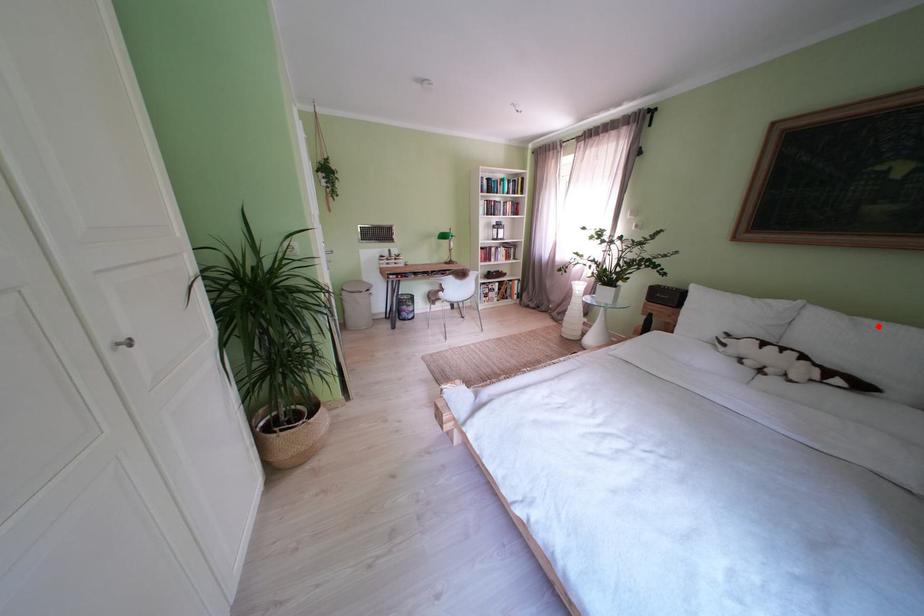
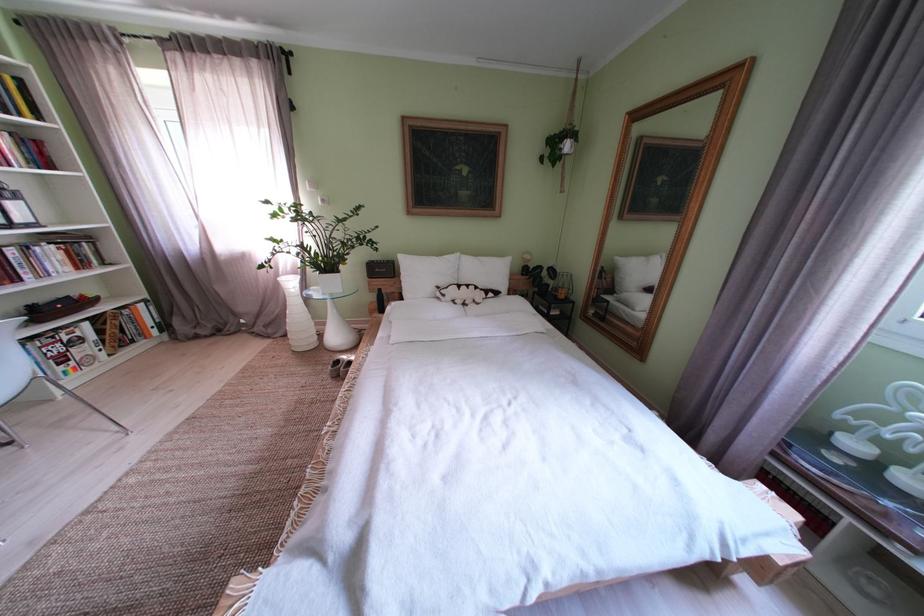
In the second image, find the point that corresponds to the highlighted location in the first image.

(492, 264)